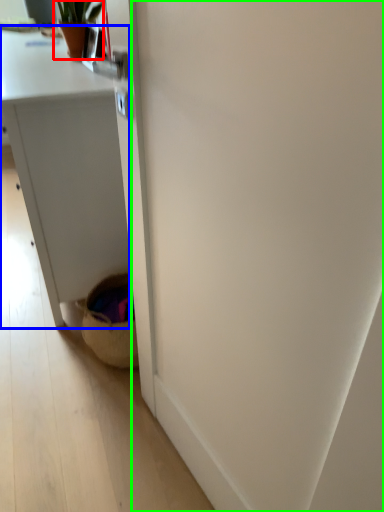
Question: Which object is the farthest from houseplant (highlighted by a red box)? Choose among these: desk (highlighted by a blue box) or screen door (highlighted by a green box).

Choices:
 (A) desk
 (B) screen door

Answer: (B)